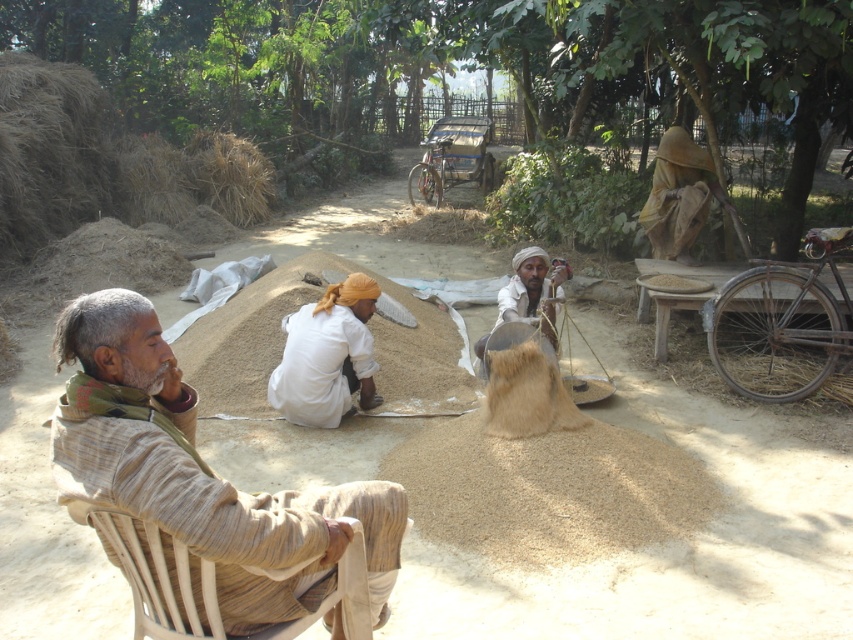
Question: Among these points, which one is nearest to the camera?

Choices:
 (A) (537, 316)
 (B) (347, 364)
 (C) (190, 602)
 (D) (320, 570)

Answer: (C)

Question: Is the position of white cotton turban at center less distant than that of light brown fabric at center?

Choices:
 (A) yes
 (B) no

Answer: (A)

Question: Is beige fabric chair at left bigger than white cotton turban at center?

Choices:
 (A) no
 (B) yes

Answer: (B)

Question: Can you confirm if beige fabric chair at left is positioned below white cotton turban at center?

Choices:
 (A) no
 (B) yes

Answer: (B)

Question: Which point is closer to the camera?

Choices:
 (A) white cotton turban at center
 (B) beige fabric chair at left
 (C) light brown fabric at center

Answer: (B)

Question: Which of the following is the farthest from the observer?

Choices:
 (A) (366, 307)
 (B) (537, 276)
 (C) (183, 472)
 (D) (349, 570)

Answer: (B)